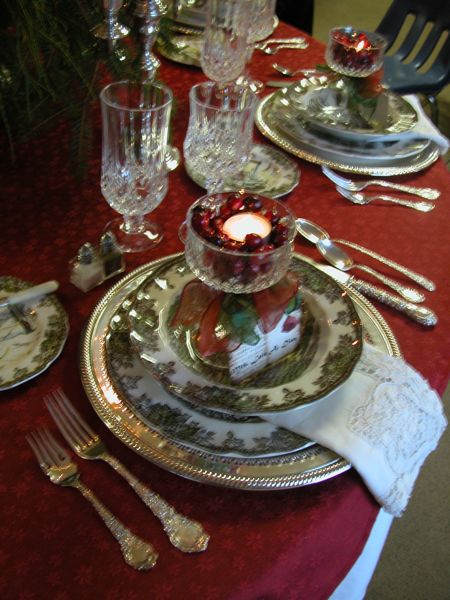
The width and height of the screenshot is (450, 600). What are the coordinates of `bowl` in the screenshot? It's located at (297, 394), (309, 100), (198, 13).